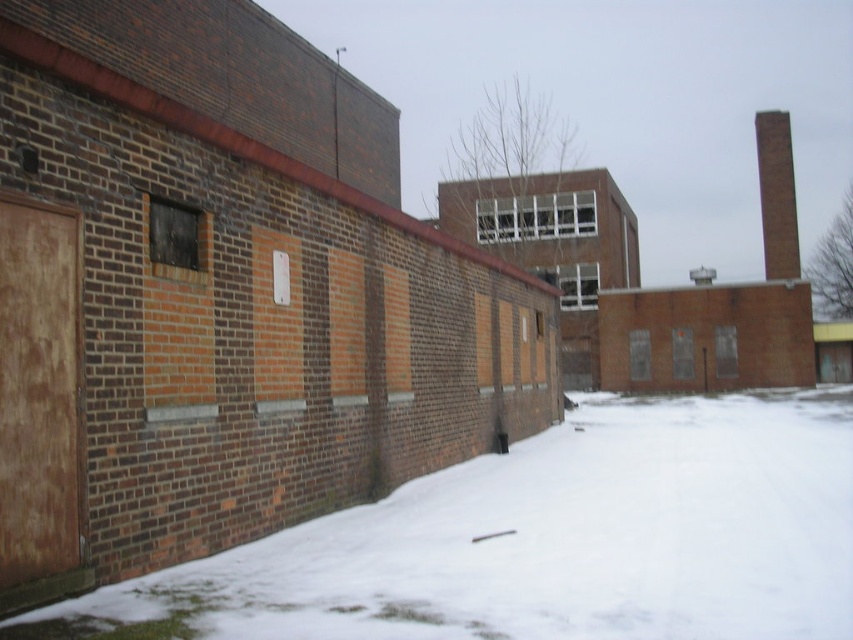
You are standing at the center of the image and want to walk towards the white powdery snow at lower left. Which direction should you face to move directly towards it?

To move directly towards the white powdery snow at lower left from the center of the image, you should face the lower left direction since that is where the snow is located.

You are standing in front of the brick wall with the boarded door and notice the white powdery snow at lower left and the brick chimney at upper right. Which object is positioned higher in the image?

The brick chimney at upper right is positioned higher in the image than the white powdery snow at lower left.